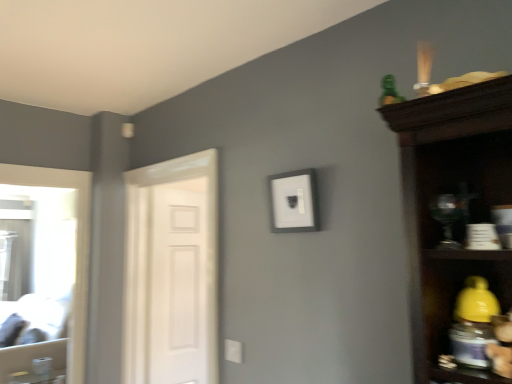
Question: From the image's perspective, relative to white matte picture frame at center, is green plastic toy at upper right above or below?

Choices:
 (A) below
 (B) above

Answer: (B)

Question: Is green plastic toy at upper right taller or shorter than white matte picture frame at center?

Choices:
 (A) short
 (B) tall

Answer: (A)

Question: Estimate the real-world distances between objects in this image. Which object is farther from the green plastic toy at upper right?

Choices:
 (A) white painted wood door at left
 (B) white matte picture frame at center
 (C) white matte door at left

Answer: (C)

Question: Considering the real-world distances, which object is closest to the white painted wood door at left?

Choices:
 (A) green plastic toy at upper right
 (B) white matte picture frame at center
 (C) white matte door at left

Answer: (C)